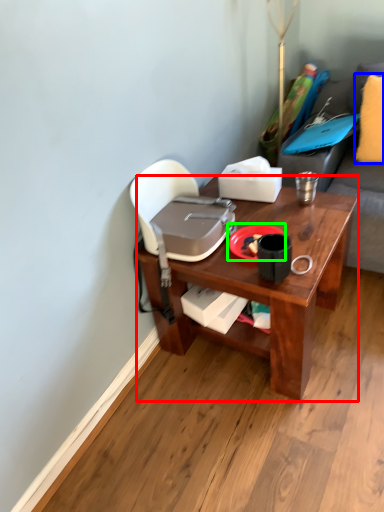
Question: Which object is positioned farthest from desk (highlighted by a red box)? Select from pillow (highlighted by a blue box) and plate (highlighted by a green box).

Choices:
 (A) pillow
 (B) plate

Answer: (A)